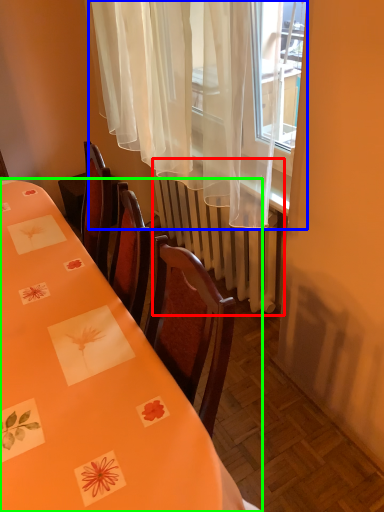
Question: Considering the real-world distances, which object is farthest from radiator (highlighted by a red box)? curtain (highlighted by a blue box) or table (highlighted by a green box)?

Choices:
 (A) curtain
 (B) table

Answer: (B)